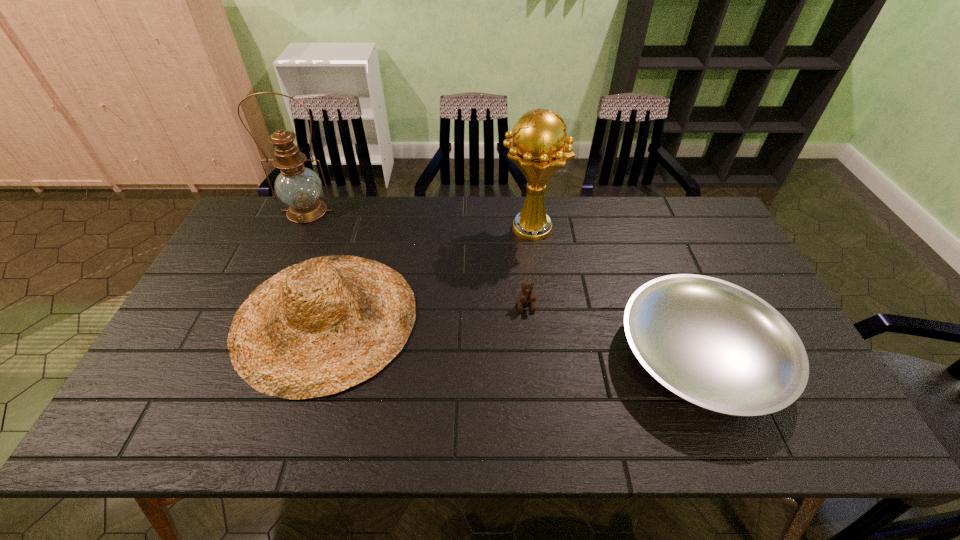
Where is `vacant space that is in between the teddy bear and the trophy_cup`? Image resolution: width=960 pixels, height=540 pixels. vacant space that is in between the teddy bear and the trophy_cup is located at coordinates (528, 267).

Locate an element on the screen. free space between the teddy bear and the trophy_cup is located at coordinates (528, 267).

Identify the location of free space between the teddy bear and the rightmost object. The image size is (960, 540). (613, 330).

Identify the location of free space between the teddy bear and the sunhat. Image resolution: width=960 pixels, height=540 pixels. tap(426, 312).

The height and width of the screenshot is (540, 960). I want to click on free point between the bedpan and the trophy_cup, so click(x=615, y=292).

Identify the location of object that ranks as the fourth closest to the rightmost object. (299, 187).

Identify which object is the closest to the teddy bear. Please provide its 2D coordinates. Your answer should be formatted as a tuple, i.e. [(x, y)], where the tuple contains the x and y coordinates of a point satisfying the conditions above.

[(712, 343)]

Where is `vacant space that satisfies the following two spatial constraints: 1. at the front of the trophy_cup where the globe is prominent; 2. on the face of the teddy bear`? vacant space that satisfies the following two spatial constraints: 1. at the front of the trophy_cup where the globe is prominent; 2. on the face of the teddy bear is located at coordinates (540, 305).

This screenshot has width=960, height=540. I want to click on free space that satisfies the following two spatial constraints: 1. on the front side of the oil lamp; 2. on the left side of the third shortest object, so click(259, 318).